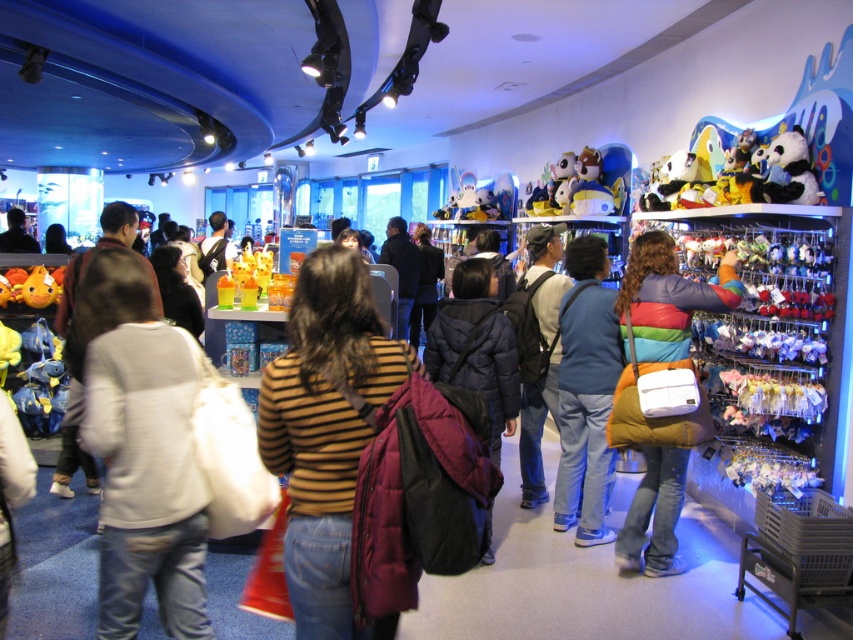
You are a store employee who needs to place a new dark blue puffer jacket at center and a striped sweater at center on a shelf that can only hold items up to 1 meter in width. Which item should you place first to ensure both fit?

The dark blue puffer jacket at center is wider than the striped sweater at center. Since the shelf can only hold items up to 1 meter, you should place the striped sweater at center first to ensure both items fit within the width constraint.